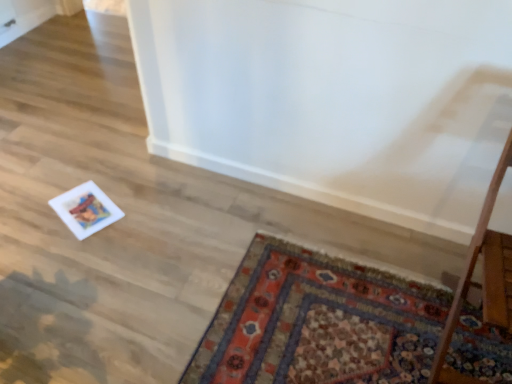
Measure the distance between carpeted mat at lower right and camera.

They are 1.40 meters apart.

The height and width of the screenshot is (384, 512). Identify the location of carpeted mat at lower right. (318, 322).

This screenshot has height=384, width=512. Describe the element at coordinates (318, 322) in the screenshot. I see `carpeted mat at lower right` at that location.

At what (x,y) coordinates should I click in order to perform the action: click on wooden table at right. Please return your answer as a coordinate pair (x, y). Image resolution: width=512 pixels, height=384 pixels. Looking at the image, I should click on (484, 277).

Image resolution: width=512 pixels, height=384 pixels. Describe the element at coordinates (484, 277) in the screenshot. I see `wooden table at right` at that location.

Where is `carpeted mat at lower right`? This screenshot has width=512, height=384. carpeted mat at lower right is located at coordinates (318, 322).

Does wooden table at right appear on the right side of carpeted mat at lower right?

Yes.

Is wooden table at right in front of carpeted mat at lower right?

Yes, it is.

Is point (492, 184) farther from camera compared to point (301, 271)?

No, it is in front of (301, 271).

From the image's perspective, which one is positioned higher, wooden table at right or carpeted mat at lower right?

wooden table at right.

From a real-world perspective, is wooden table at right under carpeted mat at lower right?

No, from a real-world perspective, wooden table at right is not below carpeted mat at lower right.

Considering the sizes of objects wooden table at right and carpeted mat at lower right in the image provided, who is thinner, wooden table at right or carpeted mat at lower right?

With smaller width is wooden table at right.

From their relative heights in the image, would you say wooden table at right is taller or shorter than carpeted mat at lower right?

Considering their sizes, wooden table at right has more height than carpeted mat at lower right.

Considering the sizes of wooden table at right and carpeted mat at lower right in the image, is wooden table at right bigger or smaller than carpeted mat at lower right?

wooden table at right is bigger than carpeted mat at lower right.

Is wooden table at right positioned beyond the bounds of carpeted mat at lower right?

wooden table at right lies outside carpeted mat at lower right's area.

Is wooden table at right next to carpeted mat at lower right?

No.

Is wooden table at right turned away from carpeted mat at lower right?

wooden table at right does not have its back to carpeted mat at lower right.

From the picture: How different are the orientations of wooden table at right and carpeted mat at lower right in degrees?

The angle between the facing direction of wooden table at right and the facing direction of carpeted mat at lower right is 91.6 degrees.

Where is `mat below the wooden table at right (from the image's perspective)`? mat below the wooden table at right (from the image's perspective) is located at coordinates (318, 322).

Based on the photo, between carpeted mat at lower right and wooden table at right, which one appears on the right side from the viewer's perspective?

From the viewer's perspective, wooden table at right appears more on the right side.

Considering their positions, is carpeted mat at lower right located in front of or behind wooden table at right?

carpeted mat at lower right is positioned farther from the viewer than wooden table at right.

Which point is more distant from viewer, (211, 330) or (508, 326)?

The point (211, 330) is more distant.

From the image's perspective, is carpeted mat at lower right under wooden table at right?

Correct, carpeted mat at lower right appears lower than wooden table at right in the image.

Based on the photo, from a real-world perspective, is carpeted mat at lower right physically located above or below wooden table at right?

Clearly, from a real-world perspective, carpeted mat at lower right is below wooden table at right.

Which object is wider, carpeted mat at lower right or wooden table at right?

With larger width is carpeted mat at lower right.

Is carpeted mat at lower right taller or shorter than wooden table at right?

carpeted mat at lower right is shorter than wooden table at right.

Consider the image. Based on their sizes in the image, would you say carpeted mat at lower right is bigger or smaller than wooden table at right?

carpeted mat at lower right is smaller than wooden table at right.

Can we say carpeted mat at lower right lies outside wooden table at right?

Yes.

Is carpeted mat at lower right placed right next to wooden table at right?

No, carpeted mat at lower right is not in contact with wooden table at right.

Looking at this image, is wooden table at right at the back of carpeted mat at lower right?

No, wooden table at right is not at the back of carpeted mat at lower right.

Where is `mat below the wooden table at right (from a real-world perspective)`? The image size is (512, 384). mat below the wooden table at right (from a real-world perspective) is located at coordinates (318, 322).

The width and height of the screenshot is (512, 384). Find the location of `mat behind the wooden table at right`. mat behind the wooden table at right is located at coordinates (318, 322).

At what (x,y) coordinates should I click in order to perform the action: click on table above the carpeted mat at lower right (from the image's perspective). Please return your answer as a coordinate pair (x, y). This screenshot has height=384, width=512. Looking at the image, I should click on (484, 277).